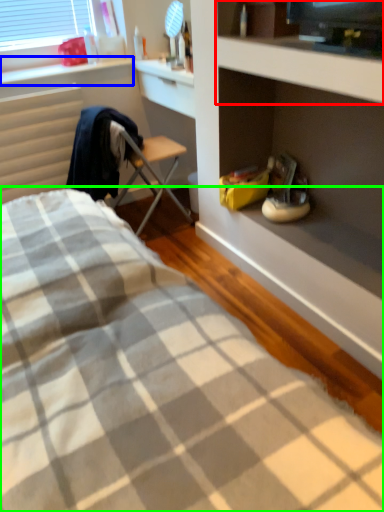
Question: Considering the real-world distances, which object is farthest from cabinet (highlighted by a red box)? window sill (highlighted by a blue box) or bed (highlighted by a green box)?

Choices:
 (A) window sill
 (B) bed

Answer: (A)